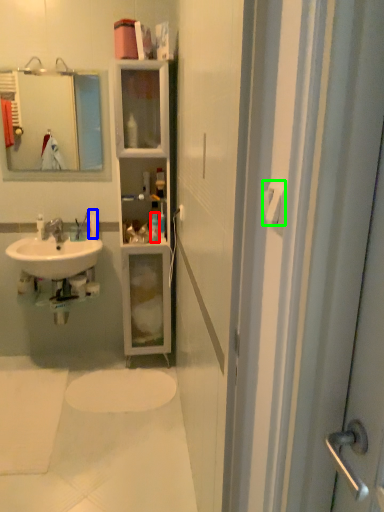
Question: Which object is positioned closest to toiletry (highlighted by a red box)? Select from toiletry (highlighted by a blue box) and towel bar (highlighted by a green box).

Choices:
 (A) toiletry
 (B) towel bar

Answer: (A)